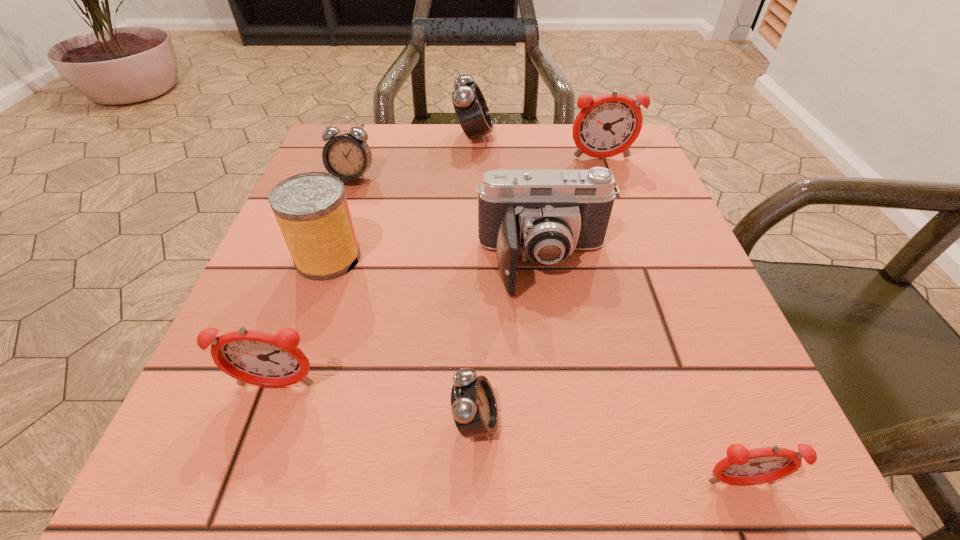
This screenshot has height=540, width=960. Find the location of `the farthest alarm clock`. the farthest alarm clock is located at coordinates (470, 106).

Find the location of `the farthest object`. the farthest object is located at coordinates (470, 106).

The width and height of the screenshot is (960, 540). In order to click on the biggest reddish-pink alarm clock in this screenshot , I will do `click(608, 125)`.

The image size is (960, 540). Identify the location of the farthest reddish-pink alarm clock. (608, 125).

You are a GUI agent. You are given a task and a screenshot of the screen. Output one action in this format:
    pyautogui.click(x=<x>, y=<y>)
    Task: Click on the camera
    Image resolution: width=960 pixels, height=540 pixels.
    Given the screenshot: What is the action you would take?
    pyautogui.click(x=544, y=215)

Identify the location of can. The width and height of the screenshot is (960, 540). (311, 209).

You are a GUI agent. You are given a task and a screenshot of the screen. Output one action in this format:
    pyautogui.click(x=<x>, y=<y>)
    Task: Click on the second smallest reddish-pink alarm clock
    The width and height of the screenshot is (960, 540).
    Given the screenshot: What is the action you would take?
    pyautogui.click(x=252, y=357)

You are a GUI agent. You are given a task and a screenshot of the screen. Output one action in this format:
    pyautogui.click(x=<x>, y=<y>)
    Task: Click on the leftmost reddish-pink alarm clock
    Image resolution: width=960 pixels, height=540 pixels.
    Given the screenshot: What is the action you would take?
    pyautogui.click(x=252, y=357)

Where is `the third farthest alarm clock`? The height and width of the screenshot is (540, 960). the third farthest alarm clock is located at coordinates (347, 156).

Where is `the leftmost white alarm clock`? The height and width of the screenshot is (540, 960). the leftmost white alarm clock is located at coordinates (347, 156).